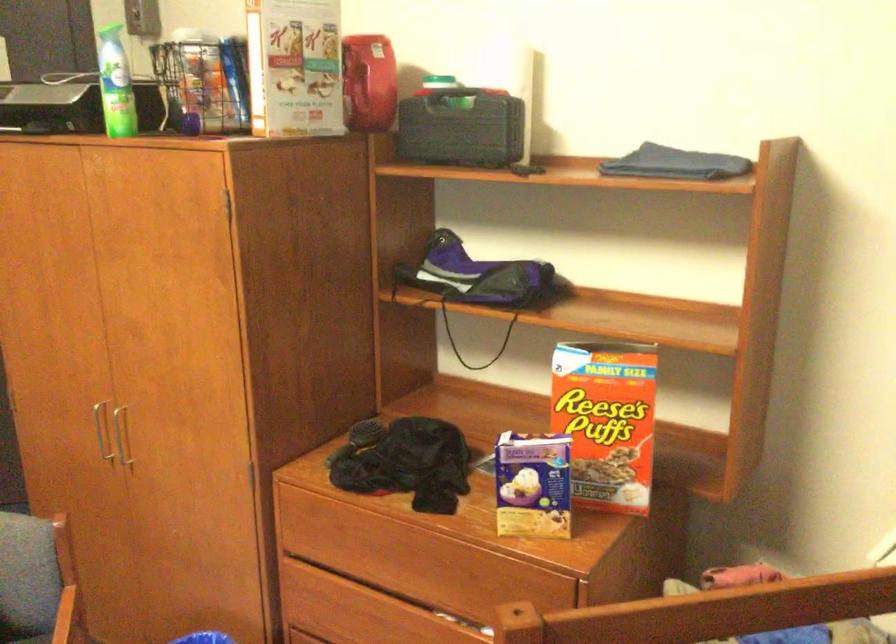
This screenshot has height=644, width=896. What do you see at coordinates (377, 598) in the screenshot?
I see `the drawer cutout handle` at bounding box center [377, 598].